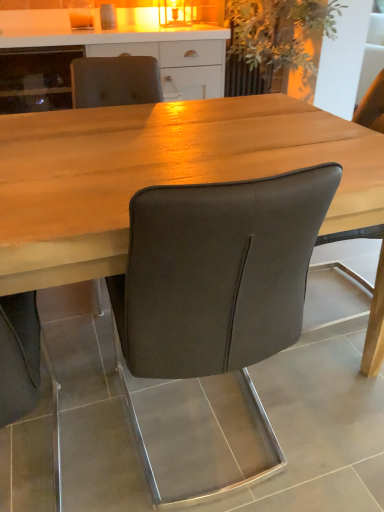
You are a GUI agent. You are given a task and a screenshot of the screen. Output one action in this format:
    pyautogui.click(x=<x>, y=<y>)
    Task: Click on the empty space that is ontop of wooden table at center (from a real-world perspective)
    
    Given the screenshot: What is the action you would take?
    tap(187, 129)